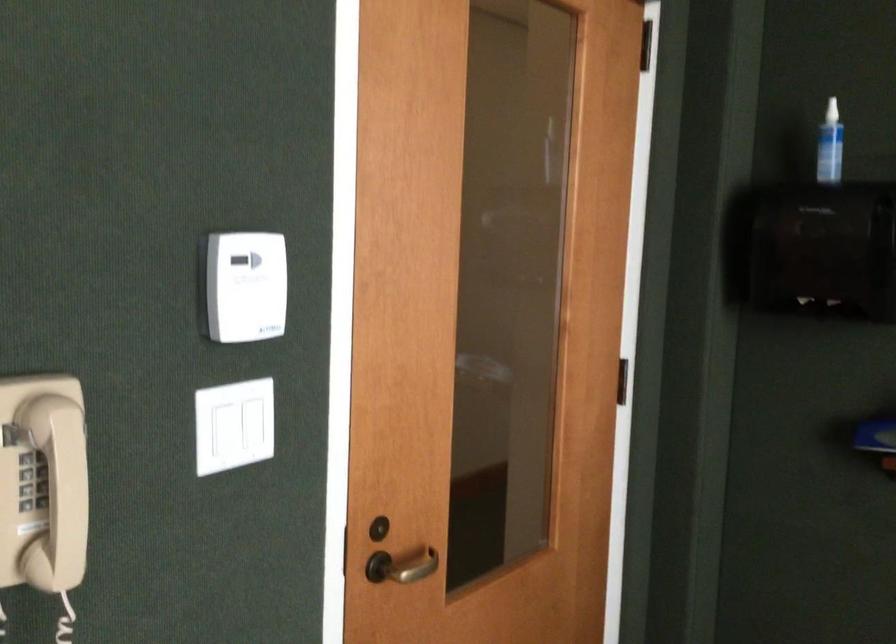
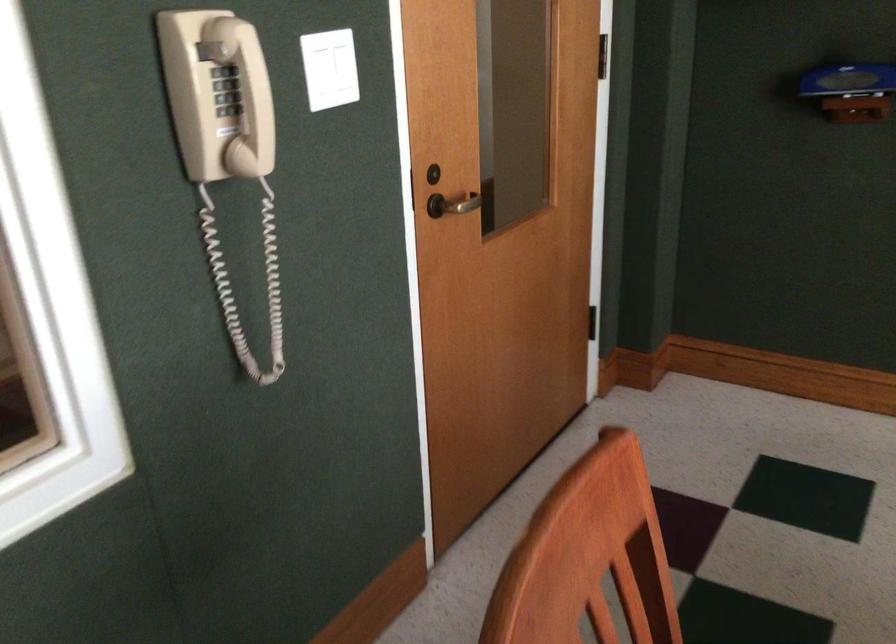
Question: The first image is from the beginning of the video and the second image is from the end. How did the camera likely rotate when shooting the video?

Choices:
 (A) Left
 (B) Right
 (C) Up
 (D) Down

Answer: (D)